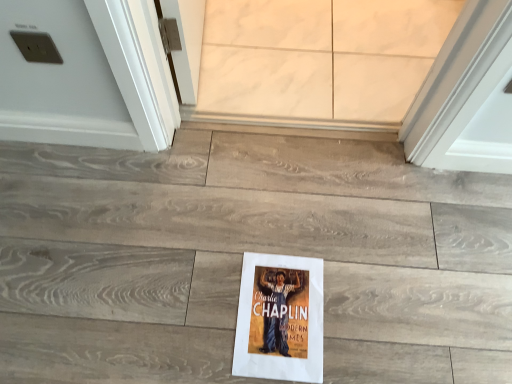
Question: Should I look upward or downward to see white paper flyer at center?

Choices:
 (A) down
 (B) up

Answer: (A)